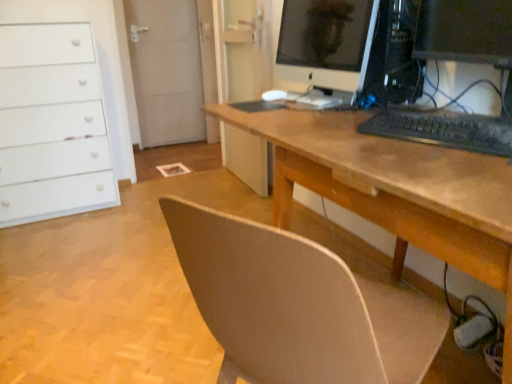
Identify the location of free location in front of black matte keyboard at center. tap(447, 163).